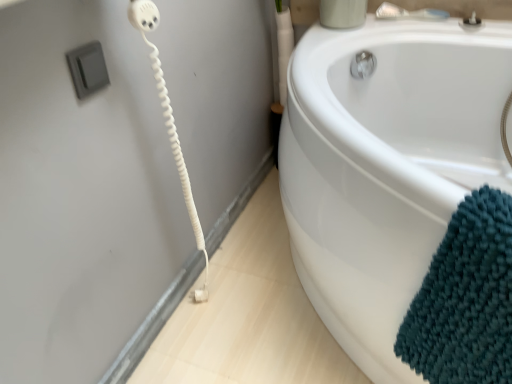
Question: Can you confirm if teal chenille bath towel at lower right is bigger than silver metallic faucet at upper right?

Choices:
 (A) no
 (B) yes

Answer: (B)

Question: Is teal chenille bath towel at lower right to the right of silver metallic faucet at upper right from the viewer's perspective?

Choices:
 (A) no
 (B) yes

Answer: (A)

Question: Does teal chenille bath towel at lower right have a lesser width compared to silver metallic faucet at upper right?

Choices:
 (A) yes
 (B) no

Answer: (B)

Question: Does teal chenille bath towel at lower right have a greater width compared to silver metallic faucet at upper right?

Choices:
 (A) yes
 (B) no

Answer: (A)

Question: From a real-world perspective, is teal chenille bath towel at lower right physically below silver metallic faucet at upper right?

Choices:
 (A) yes
 (B) no

Answer: (A)

Question: Is teal chenille bath towel at lower right next to silver metallic faucet at upper right and touching it?

Choices:
 (A) yes
 (B) no

Answer: (B)

Question: Does silver metallic faucet at upper right appear on the right side of teal chenille bath towel at lower right?

Choices:
 (A) yes
 (B) no

Answer: (A)

Question: Considering the relative sizes of silver metallic faucet at upper right and teal chenille bath towel at lower right in the image provided, is silver metallic faucet at upper right taller than teal chenille bath towel at lower right?

Choices:
 (A) yes
 (B) no

Answer: (B)

Question: Would you consider silver metallic faucet at upper right to be distant from teal chenille bath towel at lower right?

Choices:
 (A) yes
 (B) no

Answer: (B)

Question: From the image's perspective, is silver metallic faucet at upper right below teal chenille bath towel at lower right?

Choices:
 (A) no
 (B) yes

Answer: (A)

Question: Is silver metallic faucet at upper right in contact with teal chenille bath towel at lower right?

Choices:
 (A) yes
 (B) no

Answer: (B)

Question: Can you confirm if silver metallic faucet at upper right is wider than teal chenille bath towel at lower right?

Choices:
 (A) no
 (B) yes

Answer: (A)

Question: In terms of width, does teal chenille bath towel at lower right look wider or thinner when compared to silver metallic faucet at upper right?

Choices:
 (A) thin
 (B) wide

Answer: (B)